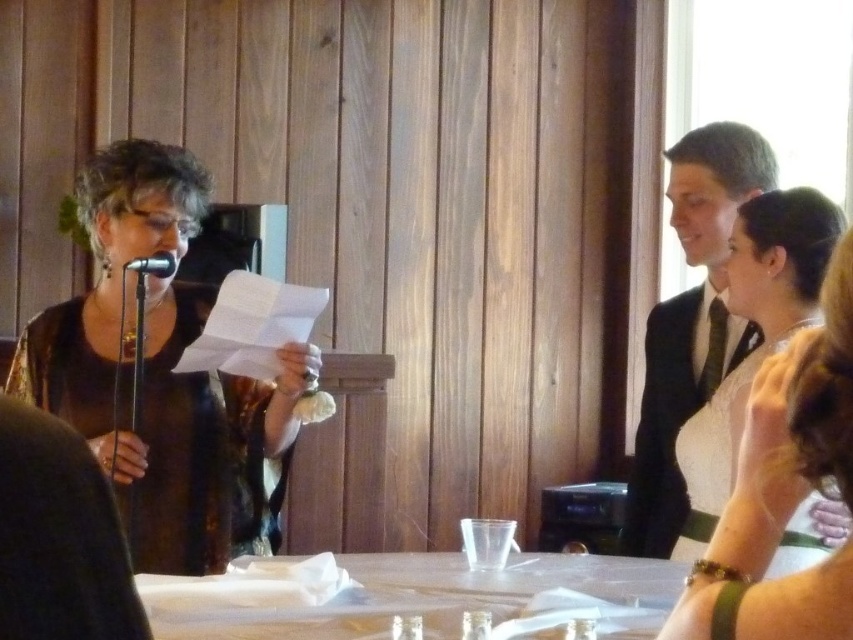
Question: Among these points, which one is farthest from the camera?

Choices:
 (A) (169, 266)
 (B) (682, 317)
 (C) (828, 236)

Answer: (B)

Question: Does matte black dress at left have a lesser width compared to black satin suit at right?

Choices:
 (A) yes
 (B) no

Answer: (B)

Question: Which point is farther to the camera?

Choices:
 (A) black satin suit at right
 (B) black metallic microphone at left

Answer: (B)

Question: Is the position of black satin suit at right more distant than that of black metallic microphone at left?

Choices:
 (A) no
 (B) yes

Answer: (A)

Question: Which of these objects is positioned farthest from the black satin suit at right?

Choices:
 (A) matte black dress at left
 (B) white satin dress at upper right
 (C) black metallic microphone at left

Answer: (C)

Question: Is matte black dress at left to the left of black satin suit at right from the viewer's perspective?

Choices:
 (A) yes
 (B) no

Answer: (A)